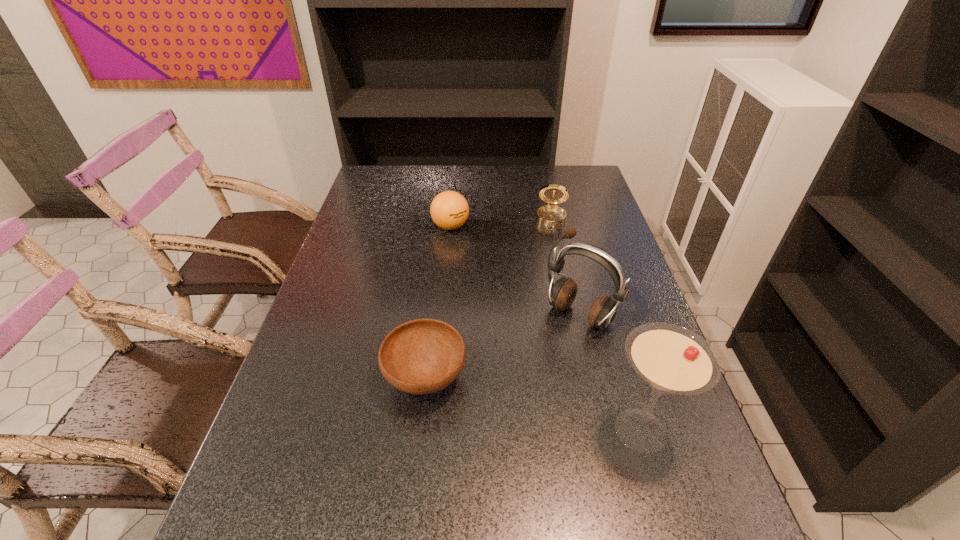
Where is `bowl`? The width and height of the screenshot is (960, 540). bowl is located at coordinates tap(422, 356).

What are the coordinates of `martini` in the screenshot? It's located at (671, 359).

Locate an element on the screen. This screenshot has height=540, width=960. ping-pong ball is located at coordinates (449, 210).

This screenshot has width=960, height=540. Identify the location of earphone. (561, 294).

Identify the location of compass. (551, 215).

You are a GUI agent. You are given a task and a screenshot of the screen. Output one action in this format:
    pyautogui.click(x=<x>, y=<y>)
    Task: Click on the vacant region located 0.360m on the right of the bowl
    
    Given the screenshot: What is the action you would take?
    pyautogui.click(x=622, y=378)

At what (x,y) coordinates should I click in order to perform the action: click on vacant space located 0.060m on the left of the martini. Please return your answer as a coordinate pair (x, y). The image size is (960, 540). Looking at the image, I should click on (573, 431).

Find the location of a particular element. The height and width of the screenshot is (540, 960). vacant space located 0.400m on the side with brand of the ping-pong ball is located at coordinates (x=489, y=325).

Identify the location of free location located 0.340m on the side with brand of the ping-pong ball. (482, 309).

Find the location of a particular element. The height and width of the screenshot is (540, 960). vacant space located 0.330m on the side with brand of the ping-pong ball is located at coordinates (481, 306).